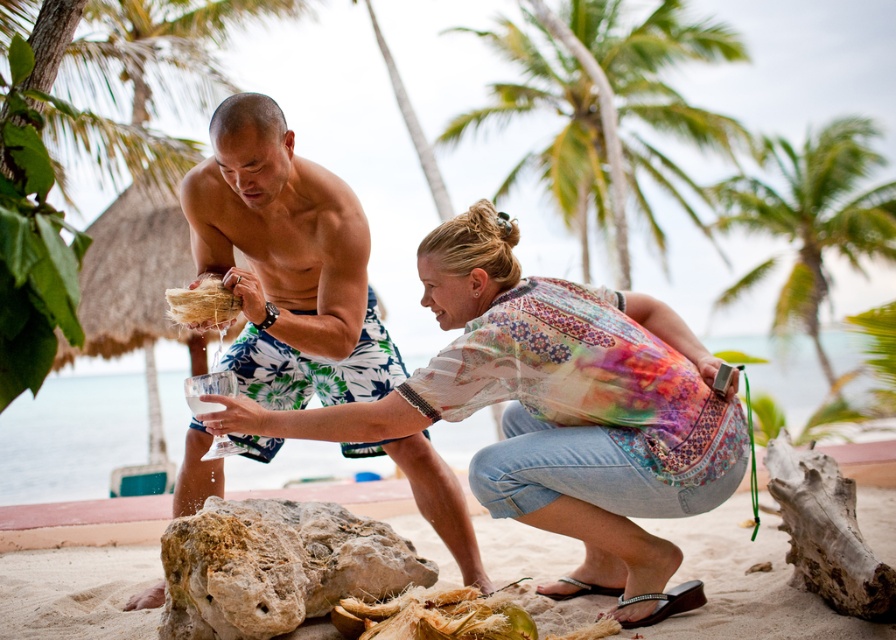
You are a fashion designer observing the beach scene. You need to determine if the distance between the printed cotton blouse at center and the shiny blue shorts at center is suitable for a coordinated outfit. The minimum required distance between clothing items in your design is 50 centimeters. Can the outfit pass your quality check?

The printed cotton blouse at center is 60.46 centimeters away from the shiny blue shorts at center, which exceeds the minimum required distance of 50 centimeters. Therefore, the outfit meets the quality check criteria.

You are a photographer standing at the beach scene. You want to take a photo that includes both the printed cotton blouse at center and the green leafy palm tree at upper center. Which object should be placed closer to the camera to ensure both are in focus?

To ensure both the printed cotton blouse at center and the green leafy palm tree at upper center are in focus, the printed cotton blouse at center should be placed closer to the camera since it is shorter in height compared to the palm tree.